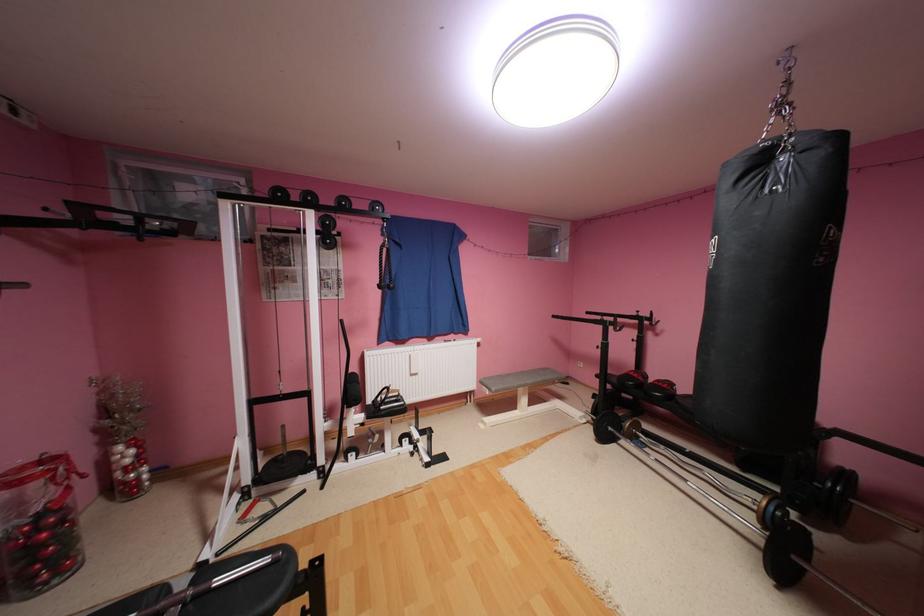
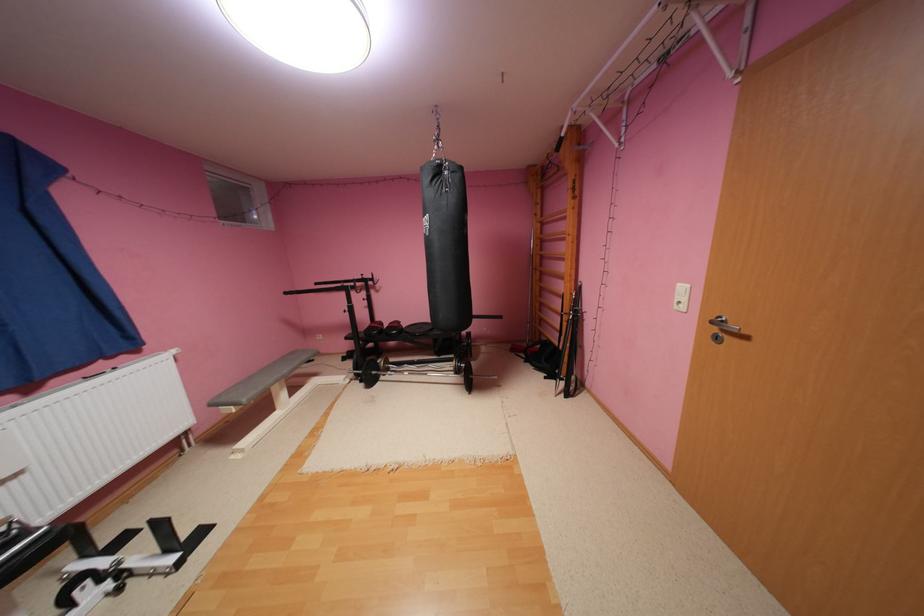
Locate, in the second image, the point that corresponds to point (494, 382) in the first image.

(233, 399)